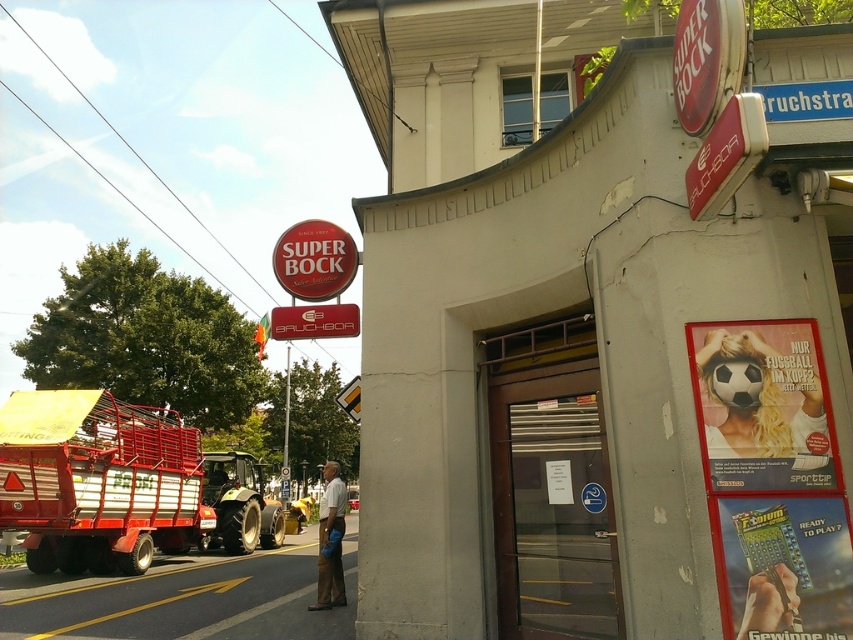
Does metallic silver phone at lower right appear on the left side of matte red sign at center?

Incorrect, metallic silver phone at lower right is not on the left side of matte red sign at center.

The width and height of the screenshot is (853, 640). Find the location of `metallic silver phone at lower right`. metallic silver phone at lower right is located at coordinates (769, 602).

Is point (776, 564) less distant than point (349, 316)?

Yes.

Where is `metallic silver phone at lower right`? The width and height of the screenshot is (853, 640). metallic silver phone at lower right is located at coordinates (769, 602).

Between matte plastic poster at right and matte red sign at center, which one is positioned higher?

matte red sign at center

Who is more forward, (x=746, y=472) or (x=332, y=310)?

Positioned in front is point (x=746, y=472).

Describe the element at coordinates (762, 404) in the screenshot. I see `matte plastic poster at right` at that location.

Where is `matte plastic poster at right`? Image resolution: width=853 pixels, height=640 pixels. matte plastic poster at right is located at coordinates (762, 404).

Who is more distant from viewer, (822,448) or (271,253)?

Point (271,253)

Which of these two, matte plastic poster at right or matte red sign at upper center, stands shorter?

matte red sign at upper center

Which is in front, point (767, 451) or point (349, 266)?

Point (767, 451) is in front.

At what (x,y) coordinates should I click in order to perform the action: click on matte plastic poster at right. Please return your answer as a coordinate pair (x, y). Image resolution: width=853 pixels, height=640 pixels. Looking at the image, I should click on (762, 404).